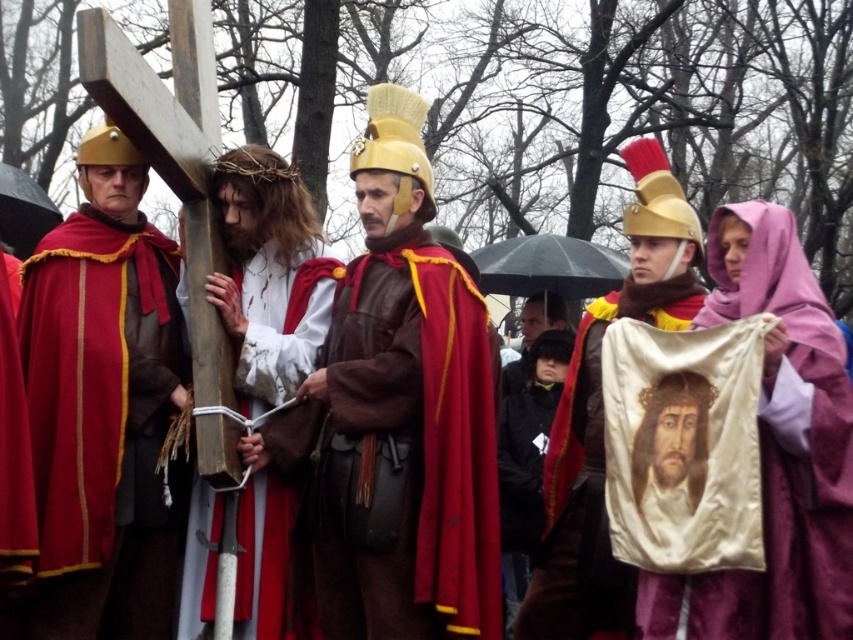
You are an event planner setting up a stage backdrop for a religious play. The backdrop needs to include both the purple velvet veil at upper right and the matte gold helmet at center. Given their sizes, which object should be placed closer to the front of the stage to ensure visibility?

The matte gold helmet at center should be placed closer to the front of the stage because it occupies more space than the purple velvet veil at upper right, making it easier to see from the audience perspective.

You are a photographer positioned at the center of the scene. You want to capture a closeup of the purple velvet veil at upper right without including any of the people in the frame. Based on its position, can you estimate if the veil is within your camera view that has a 60 degree field of view?

The purple velvet veil at upper right is located at point (x=782, y=442), which is outside the 60 degree field of view from the center position, so it might not be fully visible in the frame without adjusting the camera angle.

You are a photographer trying to capture a clear shot of the purple velvet veil at upper right and the matte gold helmet at center. Which object should you focus on first to ensure both are in focus?

The purple velvet veil at upper right is closer to the viewer than the matte gold helmet at center. To ensure both are in focus, you should focus on the purple velvet veil at upper right first, as it is closer, and the matte gold helmet at center will be in the depth of field range if focused properly on the closer object.